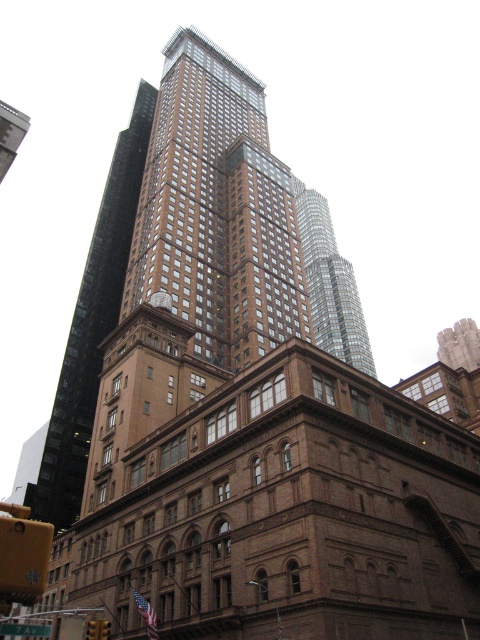
You are standing at point A located at point (81, 481). You want to walk to point B which is 259.87 feet away. The path is clear except for a construction zone that starts at 150 feet from point A. Will you encounter the construction zone before reaching point B?

Yes, you will encounter the construction zone before reaching point B because the construction zone starts at 150 feet from point A, which is less than the total distance of 259.87 feet to point B.

You are a drone operator tasked with flying a drone between the brown glassy building at center and the glassy reflective skyscraper at center. The drone has a maximum flight distance of 250 feet. Based on the scene, can the drone safely complete the flight between these two buildings without exceeding its range?

The distance between the brown glassy building at center and the glassy reflective skyscraper at center is 244.68 feet, which is within the drone operator maximum flight distance of 250 feet. The drone can safely complete the flight between these two buildings without exceeding its range.

You are standing at the origin point of the scene. Where is the brown glassy building at center located in terms of coordinates?

The brown glassy building at center is located at coordinates point [92,326].